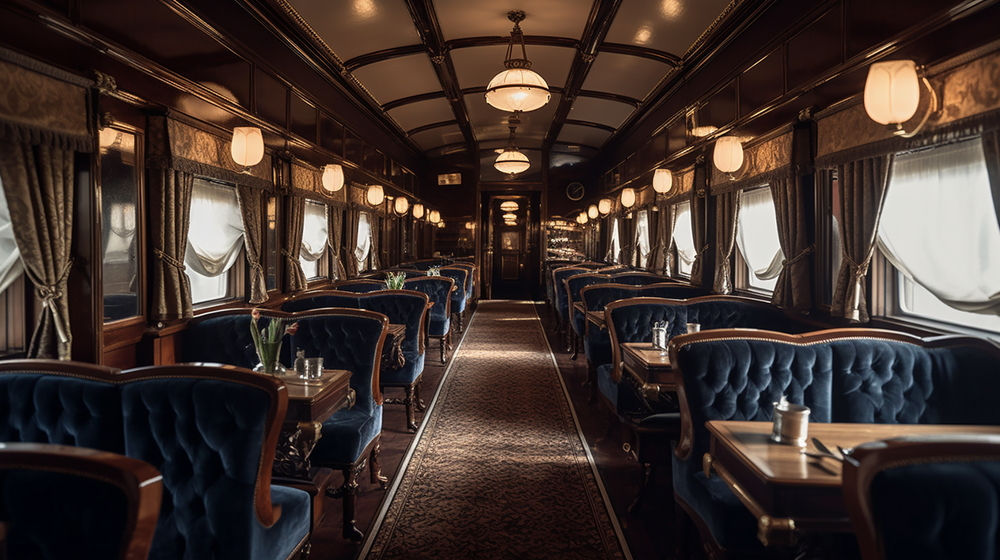
Where is `flower in vase`? flower in vase is located at coordinates (260, 342), (276, 343), (397, 284), (433, 272).